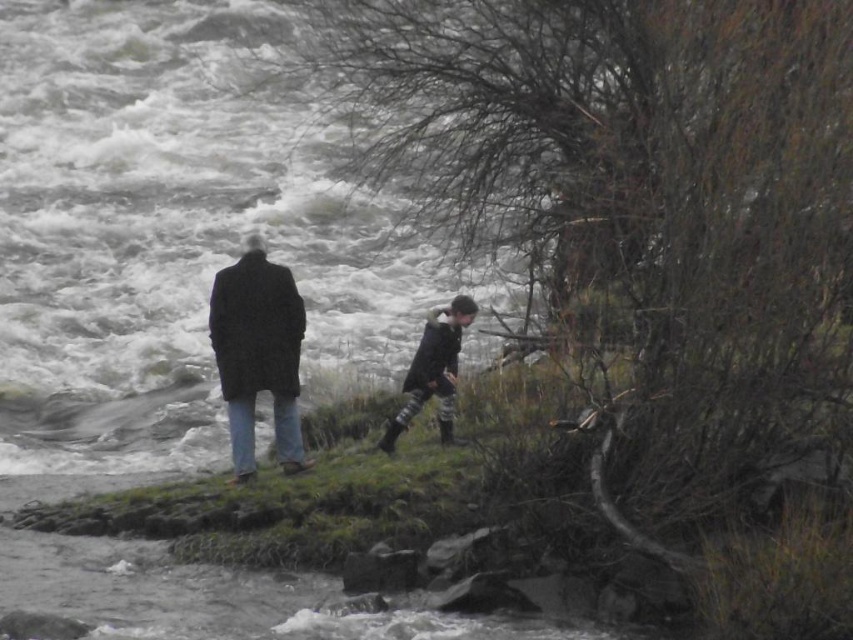
Does dark wool coat at center have a greater height compared to dark gray textured coat at center?

Yes, dark wool coat at center is taller than dark gray textured coat at center.

Does dark wool coat at center have a lesser width compared to dark gray textured coat at center?

Yes.

Is point (241, 342) in front of point (442, 346)?

That is False.

You are a GUI agent. You are given a task and a screenshot of the screen. Output one action in this format:
    pyautogui.click(x=<x>, y=<y>)
    Task: Click on the dark wool coat at center
    
    Given the screenshot: What is the action you would take?
    pyautogui.click(x=258, y=353)

Is point (84, 324) positioned in front of point (225, 384)?

That is False.

Does white frothy water at center appear on the left side of dark wool coat at center?

Yes, white frothy water at center is to the left of dark wool coat at center.

Where is `white frothy water at center`? The width and height of the screenshot is (853, 640). white frothy water at center is located at coordinates (167, 234).

This screenshot has height=640, width=853. I want to click on white frothy water at center, so click(167, 234).

Does white frothy water at center have a lesser width compared to dark gray textured coat at center?

No, white frothy water at center is not thinner than dark gray textured coat at center.

I want to click on white frothy water at center, so [x=167, y=234].